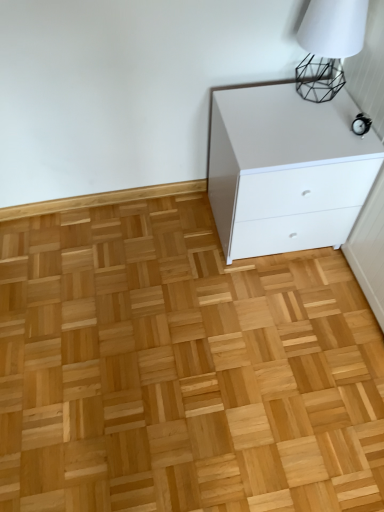
Where is `vacant area that is in front of white glossy chest of drawers at upper right`? The image size is (384, 512). vacant area that is in front of white glossy chest of drawers at upper right is located at coordinates (283, 305).